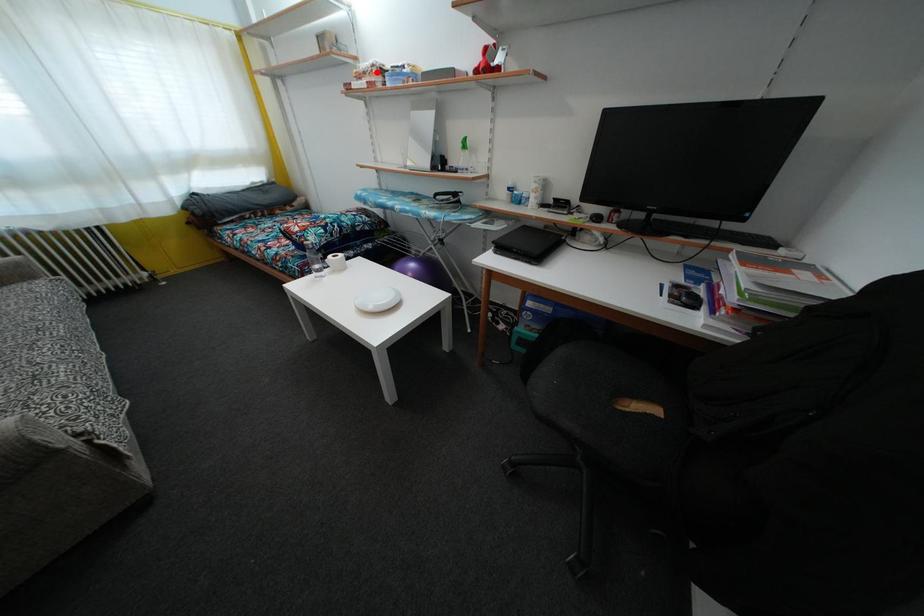
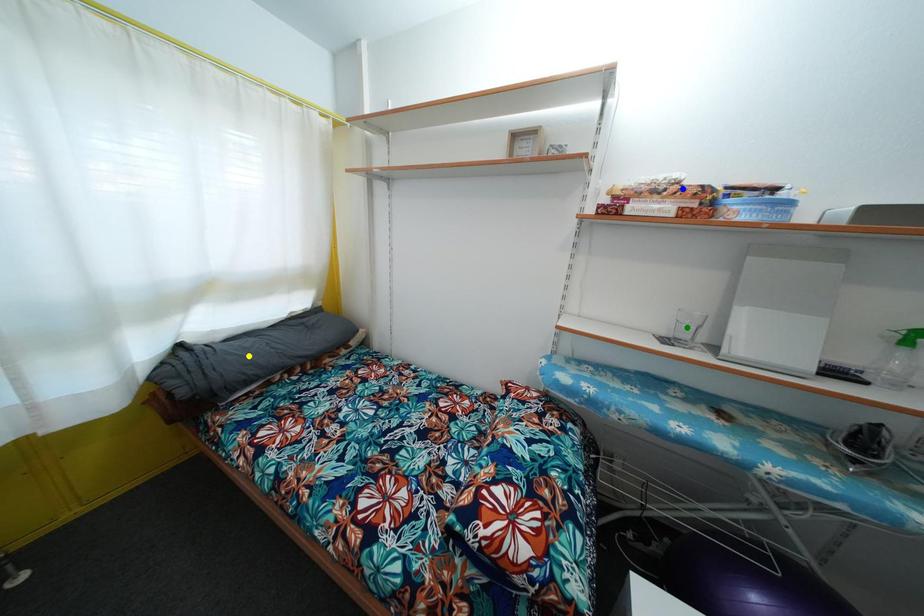
Question: I am providing you with two images of the same scene from different viewpoints. A red point is marked on the first image. You are given multiple points on the second image. In image 2, which mark is for the same physical point as the one in image 1?

Choices:
 (A) green point
 (B) yellow point
 (C) blue point

Answer: (C)